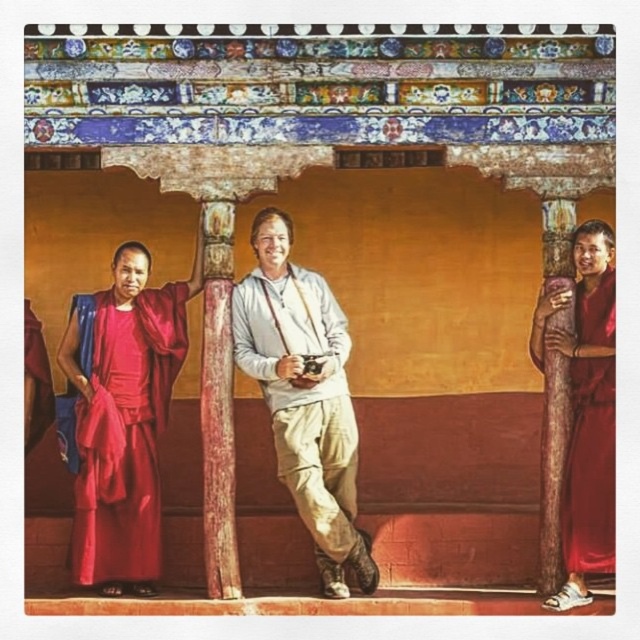
Is light gray cotton shirt at center to the right of smooth red cloth at right from the viewer's perspective?

In fact, light gray cotton shirt at center is to the left of smooth red cloth at right.

Between point (241, 355) and point (604, 252), which one is positioned in front?

Point (604, 252) is in front.

Identify the location of light gray cotton shirt at center. Image resolution: width=640 pixels, height=640 pixels. (305, 396).

Is matte gray shirt at center to the left of light gray cotton shirt at center from the viewer's perspective?

Correct, you'll find matte gray shirt at center to the left of light gray cotton shirt at center.

Who is higher up, matte gray shirt at center or light gray cotton shirt at center?

light gray cotton shirt at center

Find the location of a particular element. The image size is (640, 640). matte gray shirt at center is located at coordinates (305, 396).

Can you confirm if matte gray shirt at center is bigger than silky red robe at left?

Indeed, matte gray shirt at center has a larger size compared to silky red robe at left.

Is matte gray shirt at center taller than silky red robe at left?

Correct, matte gray shirt at center is much taller as silky red robe at left.

Between point (104, 589) and point (166, 365), which one is positioned in front?

Positioned in front is point (104, 589).

The height and width of the screenshot is (640, 640). I want to click on matte gray shirt at center, so click(x=305, y=396).